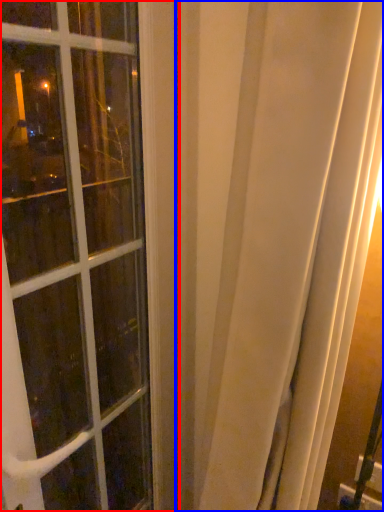
Question: Which of the following is the closest to the observer, window (highlighted by a red box) or curtain (highlighted by a blue box)?

Choices:
 (A) window
 (B) curtain

Answer: (B)